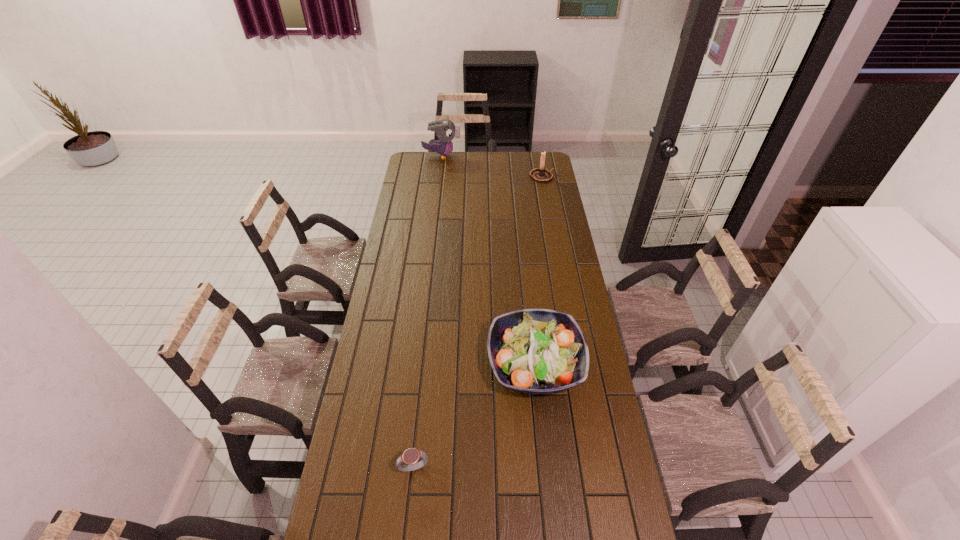
You are a GUI agent. You are given a task and a screenshot of the screen. Output one action in this format:
    pyautogui.click(x=<x>, y=<y>)
    Task: Click on the vacant area between the shortest object and the tallest object
    Image resolution: width=960 pixels, height=540 pixels.
    Given the screenshot: What is the action you would take?
    pyautogui.click(x=427, y=311)

Locate an element on the screen. This screenshot has width=960, height=540. empty space between the second shortest object and the tallest object is located at coordinates (488, 260).

At what (x,y) coordinates should I click in order to perform the action: click on unoccupied position between the shortest object and the salad plate. Please return your answer as a coordinate pair (x, y). Image resolution: width=960 pixels, height=540 pixels. Looking at the image, I should click on (474, 416).

Locate an element on the screen. This screenshot has height=540, width=960. empty location between the third nearest object and the nearest object is located at coordinates (478, 322).

Find the location of `object that is the second closest to the second farthest object`. object that is the second closest to the second farthest object is located at coordinates (538, 351).

Locate an element on the screen. object identified as the closest to the nearest object is located at coordinates (538, 351).

You are a GUI agent. You are given a task and a screenshot of the screen. Output one action in this format:
    pyautogui.click(x=<x>, y=<y>)
    Task: Click on the blank area in the image that satisfies the following two spatial constraints: 1. at the beak of the farthest object; 2. on the right side of the candle holder
    
    Given the screenshot: What is the action you would take?
    pyautogui.click(x=439, y=176)

In order to click on vacant area in the image that satisfies the following two spatial constraints: 1. at the beak of the nearest object; 2. on the left side of the tallest object in this screenshot , I will do `click(404, 467)`.

Locate an element on the screen. The width and height of the screenshot is (960, 540). vacant point that satisfies the following two spatial constraints: 1. on the back side of the shortest object; 2. on the left side of the salad plate is located at coordinates (424, 364).

I want to click on blank space that satisfies the following two spatial constraints: 1. at the beak of the third shortest object; 2. on the right side of the farthest object, so (x=439, y=176).